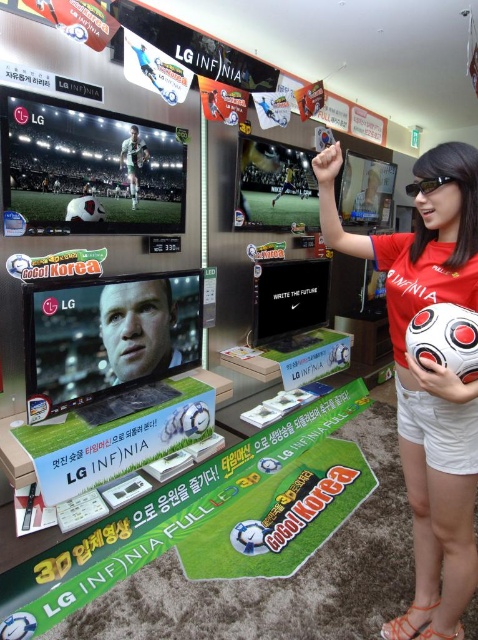
You are a photographer setting up for a product shoot in this LG promotional area. You need to position a light source so that it illuminates both the matte red shirt at center and the shiny plastic soccer ball at upper left without creating harsh shadows. Considering their positions, where should you place the light relative to the objects?

The matte red shirt at center is located below the shiny plastic soccer ball at upper left. To avoid harsh shadows, position the light source above and between the two objects, ensuring it shines down on both evenly.

Looking at this image, you are a photographer at the event and need to capture a photo that includes both the matte red shirt at center and the shiny plastic soccer ball at upper left. Based on their positions, which object should you ensure is placed to the right side in your frame?

The matte red shirt at center is positioned on the right side of the shiny plastic soccer ball at upper left, so in the frame, the shiny plastic soccer ball at upper left should be on the left and the matte red shirt at center on the right.